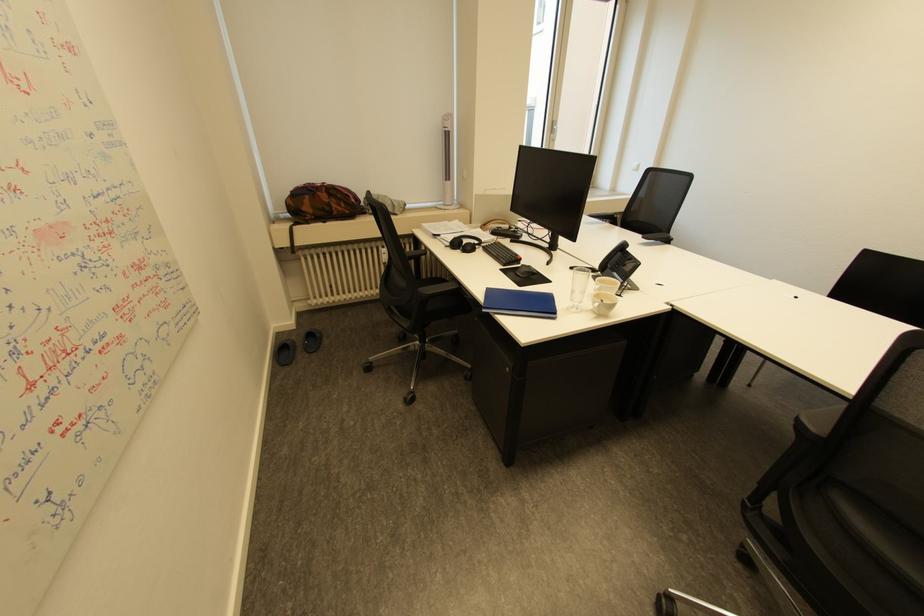
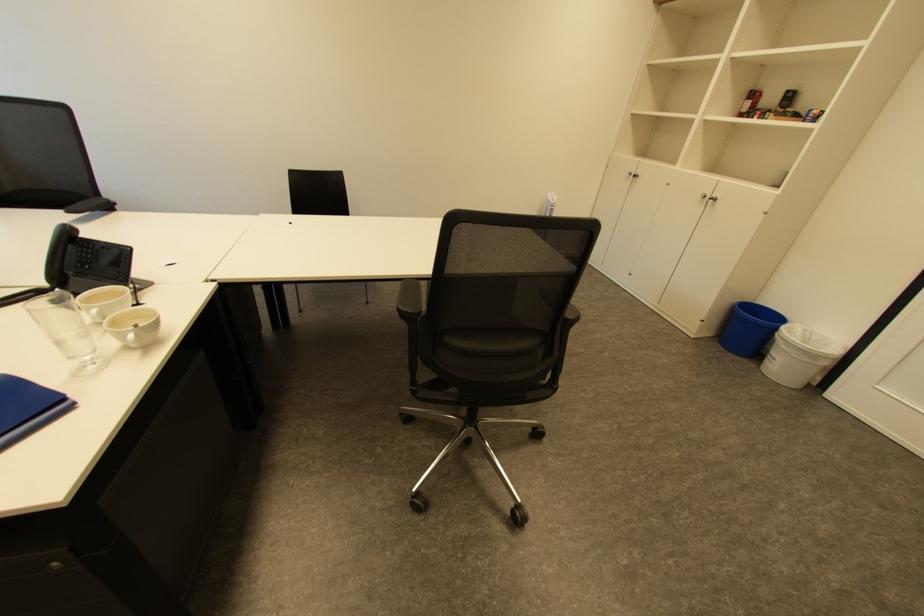
In the second image, find the point that corresponds to (578,300) in the first image.

(76, 358)